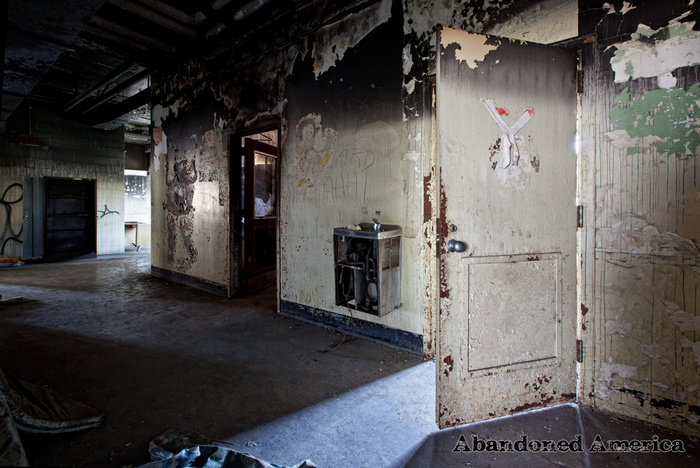
This screenshot has height=468, width=700. Find the location of `wall`. wall is located at coordinates 369,181.